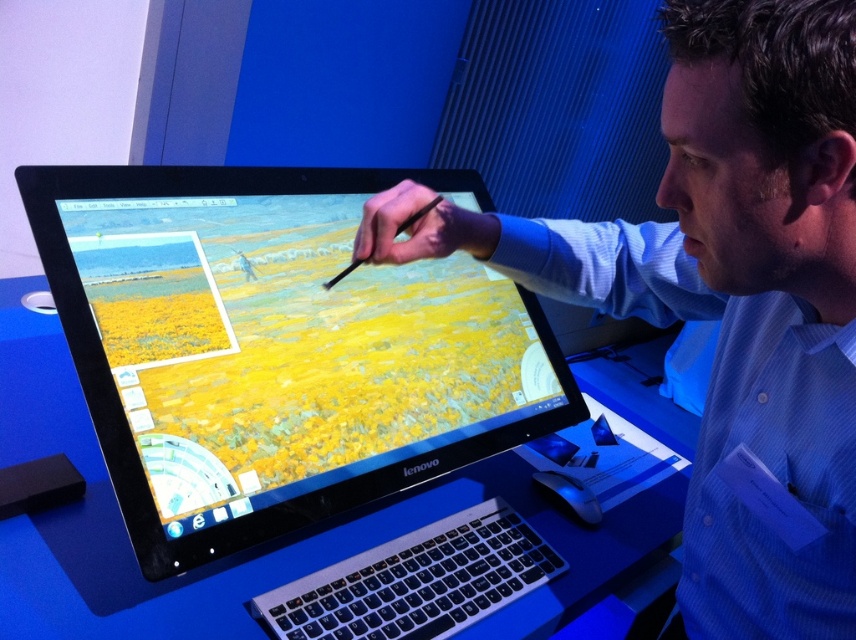
Question: Which of the following is the farthest from the observer?

Choices:
 (A) (852, 173)
 (B) (128, 481)

Answer: (B)

Question: Where is black glossy monitor at center located in relation to blue striped shirt at center in the image?

Choices:
 (A) below
 (B) above

Answer: (B)

Question: Does black glossy monitor at center have a lesser width compared to blue striped shirt at center?

Choices:
 (A) no
 (B) yes

Answer: (A)

Question: Is black glossy monitor at center in front of blue striped shirt at center?

Choices:
 (A) yes
 (B) no

Answer: (B)

Question: Which object is closer to the camera taking this photo?

Choices:
 (A) black glossy monitor at center
 (B) blue striped shirt at center

Answer: (B)